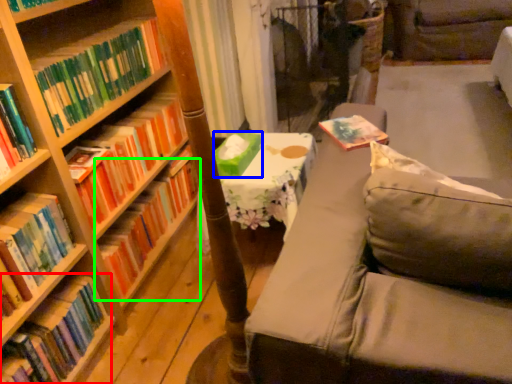
Question: Based on their relative distances, which object is nearer to book (highlighted by a red box)? Choose from paperback book (highlighted by a blue box) and book (highlighted by a green box).

Choices:
 (A) paperback book
 (B) book

Answer: (B)